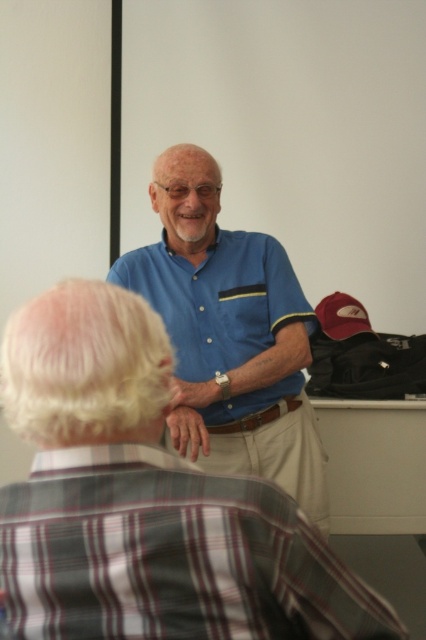
You are a photographer trying to capture a candid shot of the two people in the scene. You notice the blue cotton shirt at center and the matte blue polo shirt at center. Which one is located to the right of the other?

The blue cotton shirt at center is positioned on the right side of matte blue polo shirt at center.

You are a delivery robot with a 1 meter wide package. You need to pass between the plaid cotton shirt at lower left and the matte blue polo shirt at center. Will there be enough space for the package?

The plaid cotton shirt at lower left and matte blue polo shirt at center are 1.07 meters apart, so yes, the package can fit since the distance is greater than the package width.